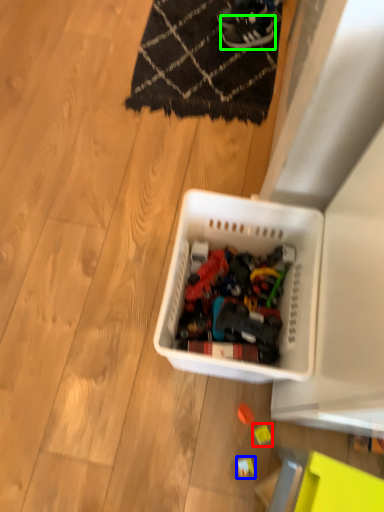
Question: Considering the real-world distances, which object is closest to toy (highlighted by a red box)? toy (highlighted by a blue box) or footwear (highlighted by a green box).

Choices:
 (A) toy
 (B) footwear

Answer: (A)